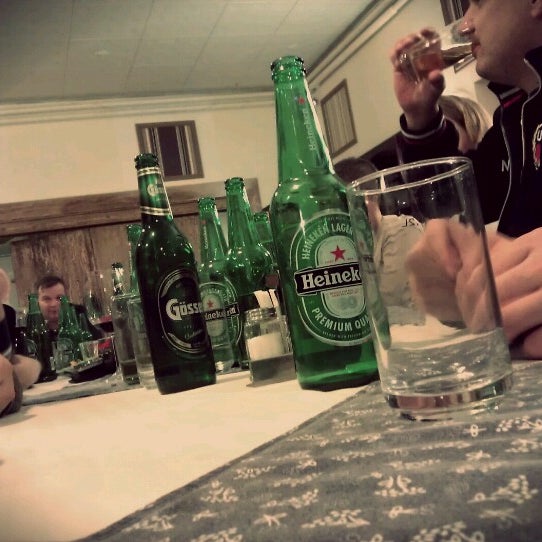
You are a GUI agent. You are given a task and a screenshot of the screen. Output one action in this format:
    pyautogui.click(x=<x>, y=<y>)
    Task: Click on the glass
    
    Given the screenshot: What is the action you would take?
    pyautogui.click(x=416, y=232), pyautogui.click(x=445, y=45)